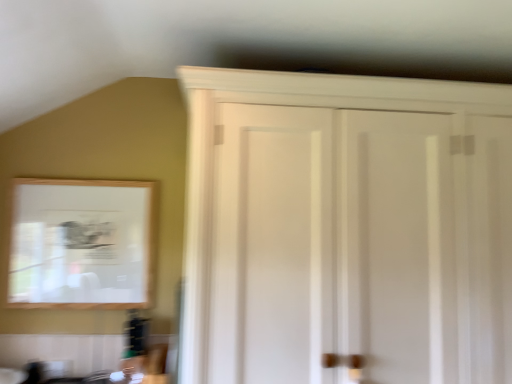
Question: From a real-world perspective, is wooden-framed mirror at upper left physically located above or below white wood cupboard at upper right?

Choices:
 (A) below
 (B) above

Answer: (A)

Question: Looking at the image, does wooden-framed mirror at upper left seem bigger or smaller compared to white wood cupboard at upper right?

Choices:
 (A) big
 (B) small

Answer: (B)

Question: Is wooden-framed mirror at upper left wider or thinner than white wood cupboard at upper right?

Choices:
 (A) wide
 (B) thin

Answer: (B)

Question: Is white wood cupboard at upper right wider or thinner than wooden-framed mirror at upper left?

Choices:
 (A) thin
 (B) wide

Answer: (B)

Question: Is white wood cupboard at upper right situated inside wooden-framed mirror at upper left or outside?

Choices:
 (A) inside
 (B) outside

Answer: (B)

Question: In the image, is white wood cupboard at upper right positioned in front of or behind wooden-framed mirror at upper left?

Choices:
 (A) behind
 (B) front

Answer: (B)

Question: From their relative heights in the image, would you say white wood cupboard at upper right is taller or shorter than wooden-framed mirror at upper left?

Choices:
 (A) short
 (B) tall

Answer: (B)